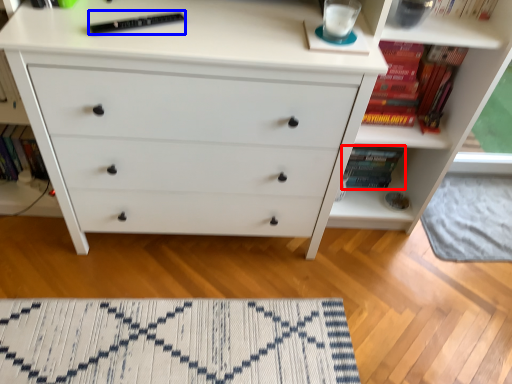
Question: Among these objects, which one is farthest to the camera, book (highlighted by a red box) or book (highlighted by a blue box)?

Choices:
 (A) book
 (B) book

Answer: (A)